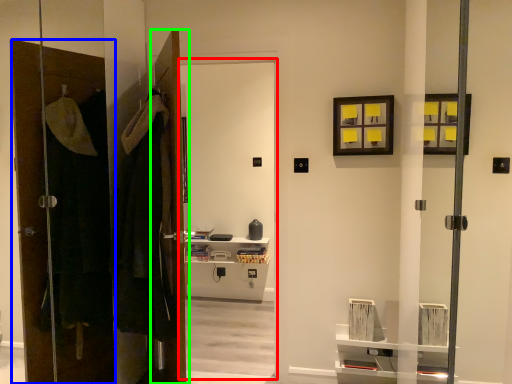
Question: Which object is the farthest from screen door (highlighted by a red box)? Choose among these: door (highlighted by a blue box) or door (highlighted by a green box).

Choices:
 (A) door
 (B) door

Answer: (A)